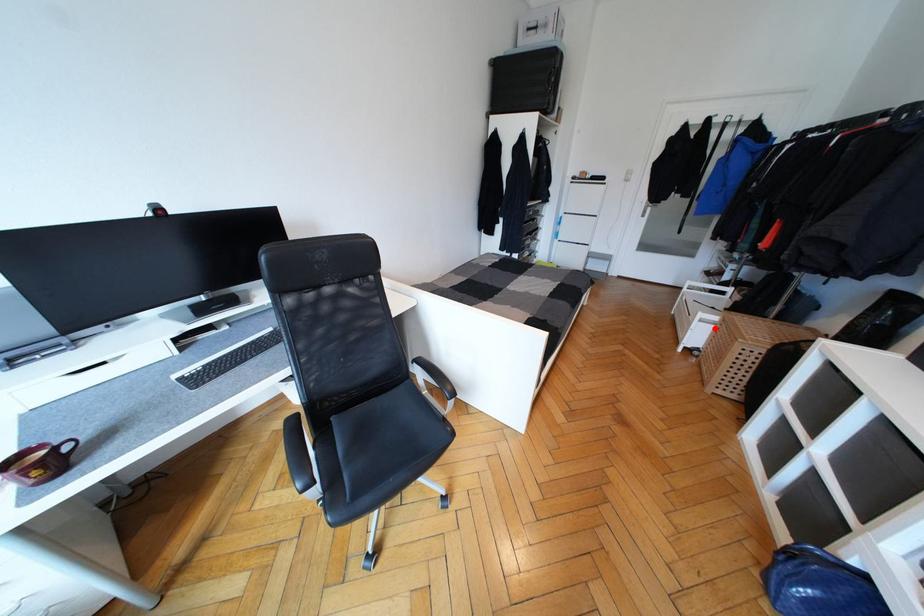
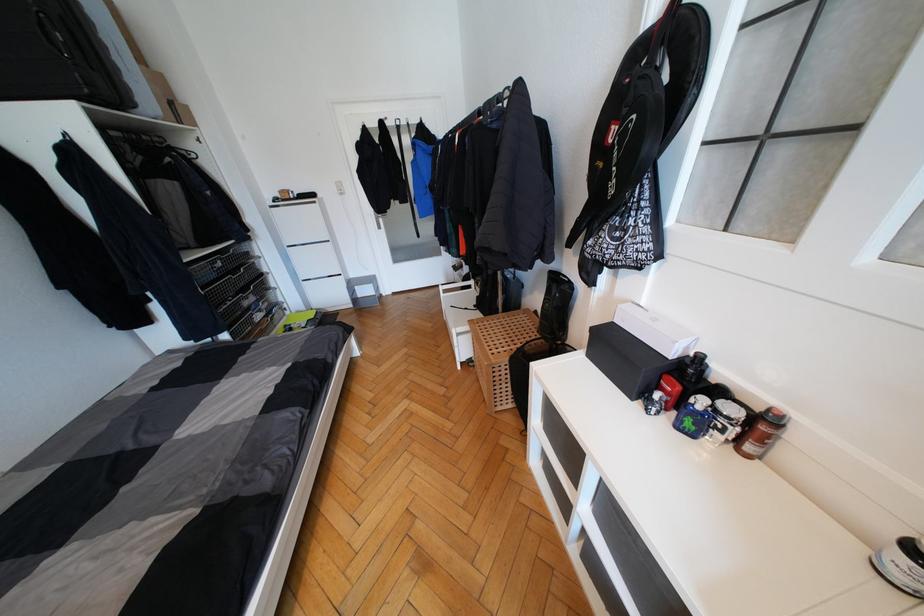
Question: I am providing you with two images of the same scene from different viewpoints. A red point is marked on the first image. At the location where the point appears in image 1, is it still visible in image 2?

Choices:
 (A) Yes
 (B) No

Answer: (A)